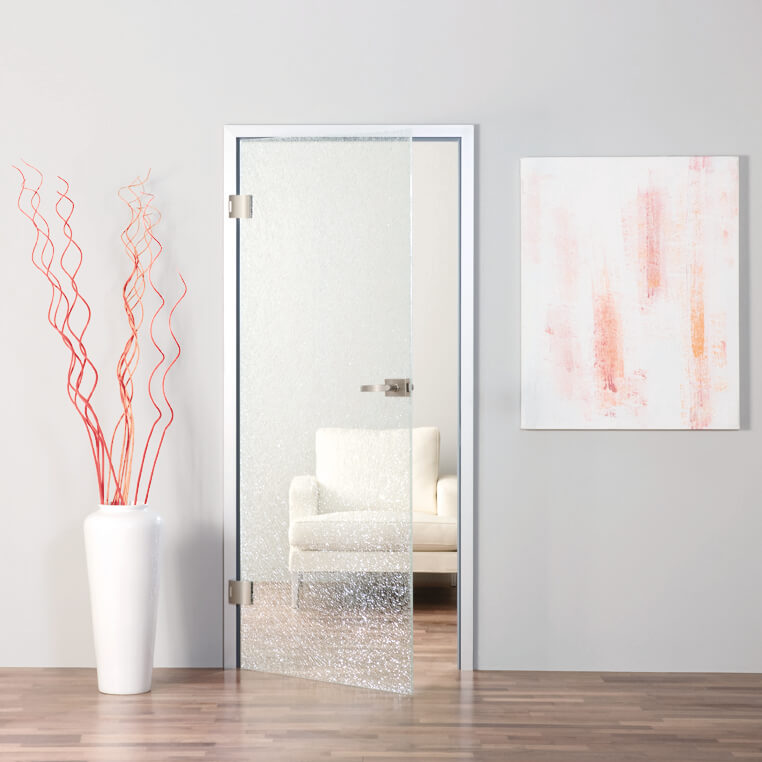
Where is `hinge`? The image size is (762, 762). hinge is located at coordinates (226, 194), (218, 606).